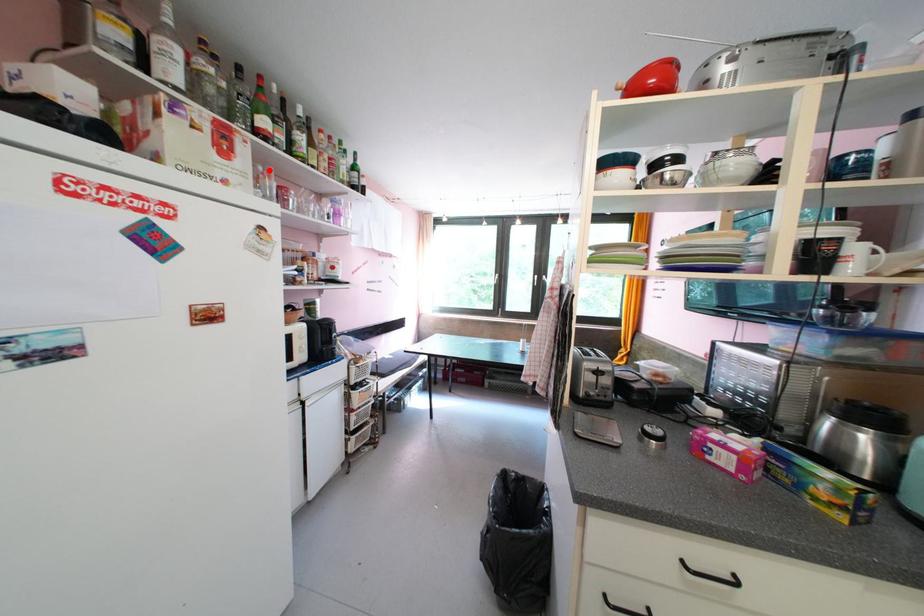
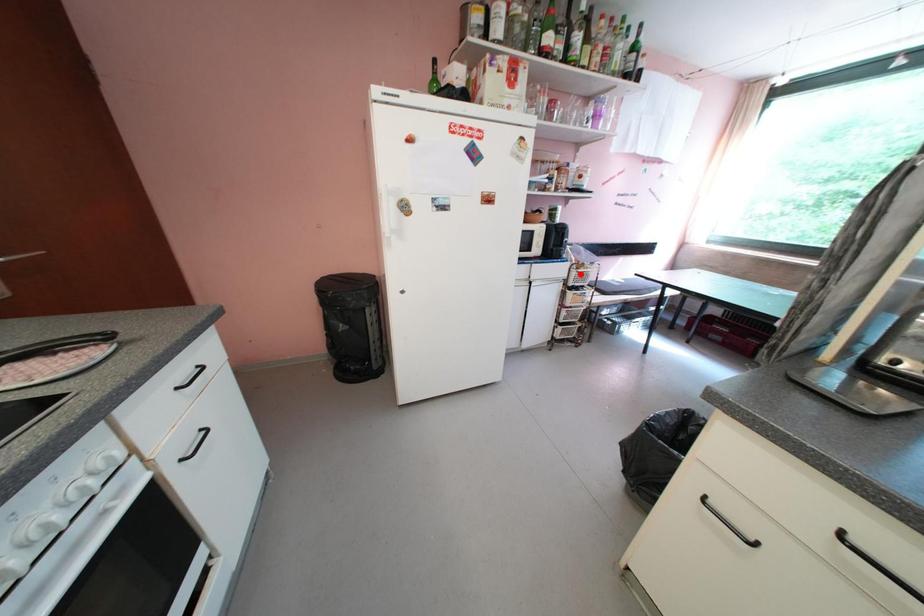
I am providing you with two images of the same scene from different viewpoints. A red point is marked on the first image and another point is marked on the second image. Does the point marked in image1 correspond to the same location as the one in image2?

No